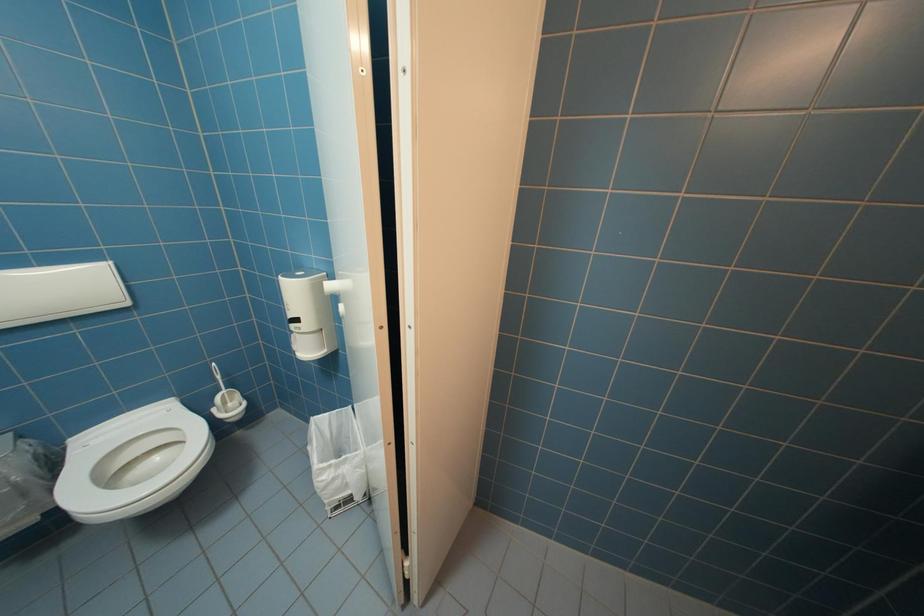
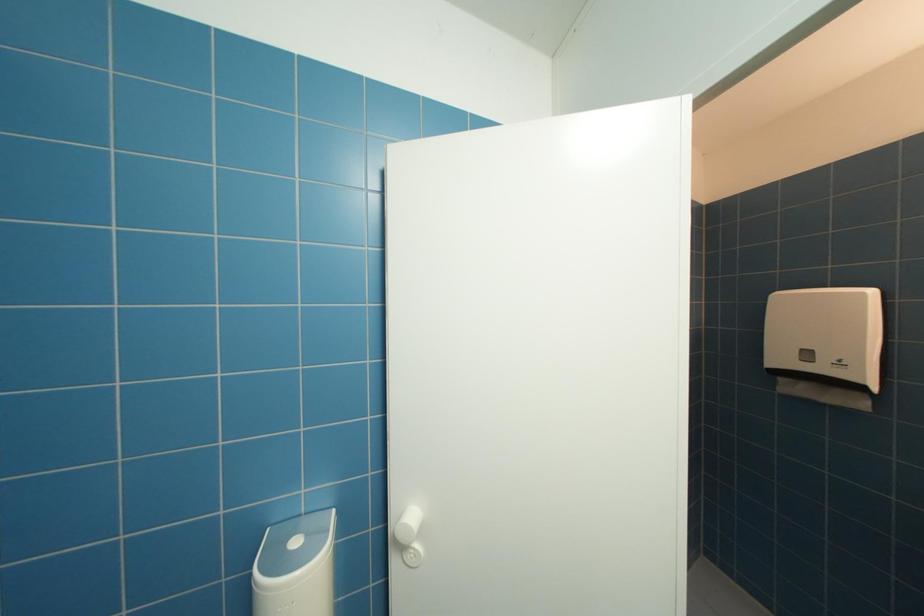
Question: The images are taken continuously from a first-person perspective. In which direction is your viewpoint rotating?

Choices:
 (A) Left
 (B) Right
 (C) Up
 (D) Down

Answer: (B)